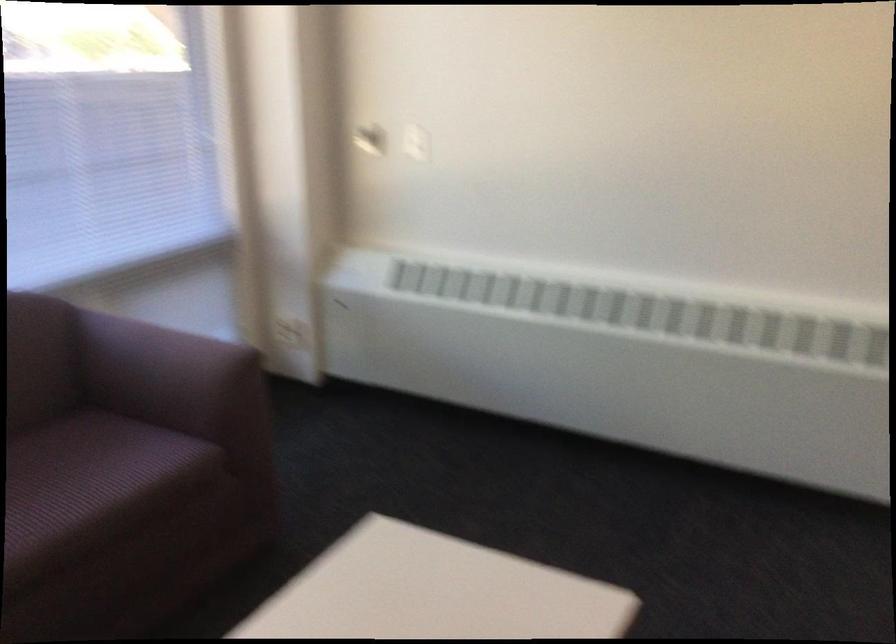
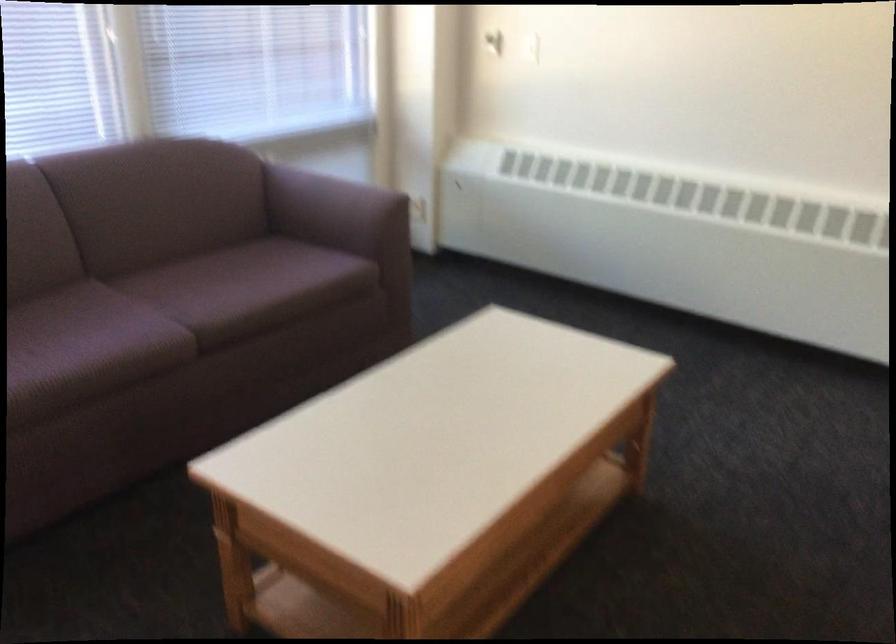
In the second image, find the point that corresponds to point (165, 375) in the first image.

(336, 211)